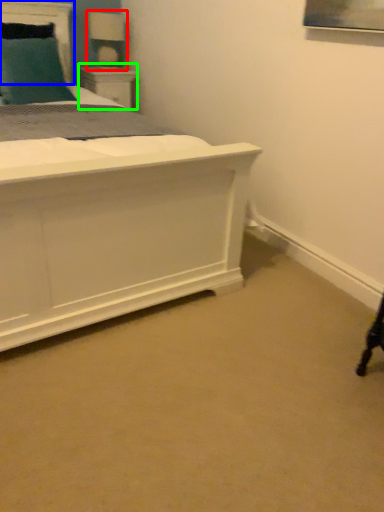
Question: Which object is positioned farthest from table lamp (highlighted by a red box)? Select from headboard (highlighted by a blue box) and nightstand (highlighted by a green box).

Choices:
 (A) headboard
 (B) nightstand

Answer: (A)